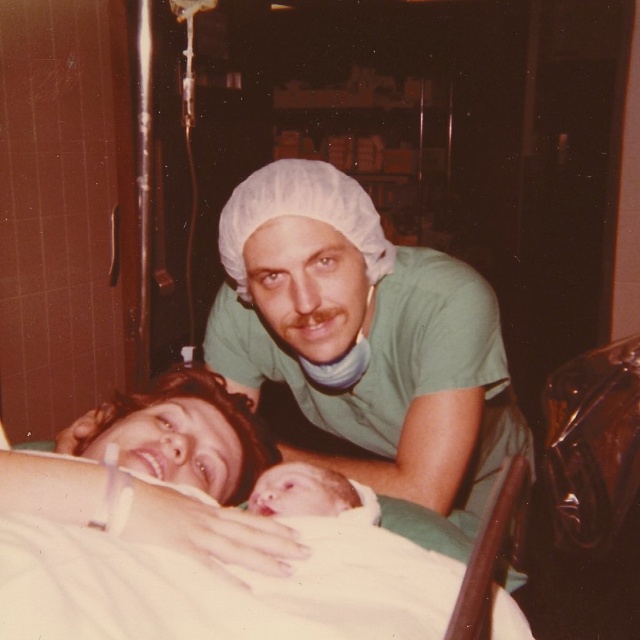
You are a photographer who just took a photo of a new mother and her baby in a hospital room. In the image, you notice a green smooth shirt at upper center and a smooth skin face at center. Which object is positioned higher in the image?

The green smooth shirt at upper center is located above the smooth skin face at center, so it is positioned higher in the image.

You are a photographer in a hospital room. You need to position a small lamp to the right of both the smooth skin face at center and the smooth skin newborn at center. Is this possible given their positions?

The smooth skin face at center is to the left of the smooth skin newborn at center, so placing the lamp to the right of both would be possible as they are aligned horizontally.

Based on the photo, you are a photographer in a hospital room. You have to take a photo of both the smooth skin face at center and the smooth skin newborn at center. Based on their sizes, which one should you focus on first to ensure both are clearly visible in the photo?

The smooth skin newborn at center is smaller than the smooth skin face at center. To ensure both are clearly visible, focus on the smooth skin newborn at center first since it is smaller and might require closer attention to capture details.